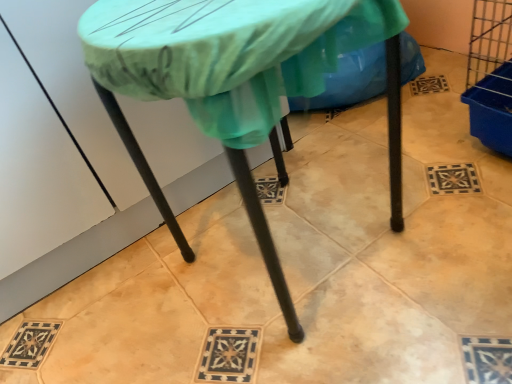
Question: Based on their sizes in the image, would you say green fabric at center is bigger or smaller than matte green tablecloth at center?

Choices:
 (A) big
 (B) small

Answer: (B)

Question: Considering the positions of green fabric at center and matte green tablecloth at center in the image, is green fabric at center taller or shorter than matte green tablecloth at center?

Choices:
 (A) short
 (B) tall

Answer: (A)

Question: Is point (263, 104) positioned closer to the camera than point (329, 43)?

Choices:
 (A) farther
 (B) closer

Answer: (B)

Question: From a real-world perspective, is matte green tablecloth at center above or below green fabric at center?

Choices:
 (A) above
 (B) below

Answer: (A)

Question: From the image's perspective, is matte green tablecloth at center positioned above or below green fabric at center?

Choices:
 (A) below
 (B) above

Answer: (A)

Question: Is matte green tablecloth at center inside or outside of green fabric at center?

Choices:
 (A) inside
 (B) outside

Answer: (B)

Question: Considering the positions of point (150, 29) and point (268, 54), is point (150, 29) closer or farther from the camera than point (268, 54)?

Choices:
 (A) farther
 (B) closer

Answer: (A)